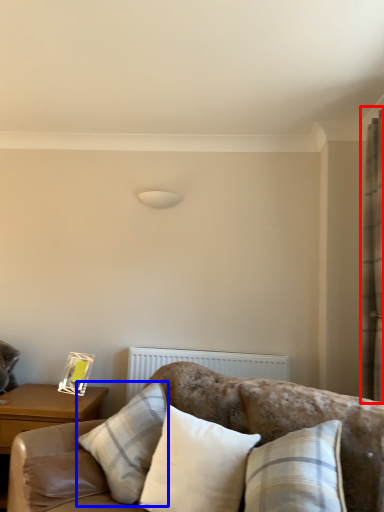
Question: Which object appears farthest to the camera in this image, curtain (highlighted by a red box) or pillow (highlighted by a blue box)?

Choices:
 (A) curtain
 (B) pillow

Answer: (A)